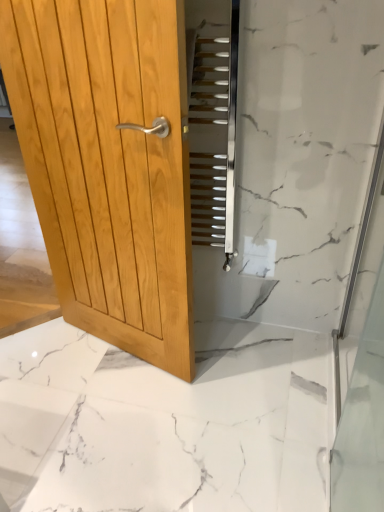
Question: Is light brown wood door at left outside white marble floor at center?

Choices:
 (A) no
 (B) yes

Answer: (B)

Question: From the image's perspective, is light brown wood door at left above white marble floor at center?

Choices:
 (A) yes
 (B) no

Answer: (A)

Question: Is light brown wood door at left bigger than white marble floor at center?

Choices:
 (A) yes
 (B) no

Answer: (B)

Question: Does light brown wood door at left turn towards white marble floor at center?

Choices:
 (A) yes
 (B) no

Answer: (A)

Question: Can you confirm if light brown wood door at left is wider than white marble floor at center?

Choices:
 (A) no
 (B) yes

Answer: (A)

Question: Is light brown wood door at left behind white marble floor at center?

Choices:
 (A) yes
 (B) no

Answer: (B)

Question: Is light brown wood door at left taller than metallic silver stairs at center?

Choices:
 (A) yes
 (B) no

Answer: (A)

Question: Is light brown wood door at left thinner than metallic silver stairs at center?

Choices:
 (A) yes
 (B) no

Answer: (B)

Question: Can you confirm if light brown wood door at left is positioned to the left of metallic silver stairs at center?

Choices:
 (A) yes
 (B) no

Answer: (A)

Question: Can you confirm if light brown wood door at left is positioned to the right of metallic silver stairs at center?

Choices:
 (A) yes
 (B) no

Answer: (B)

Question: From a real-world perspective, is light brown wood door at left beneath metallic silver stairs at center?

Choices:
 (A) no
 (B) yes

Answer: (B)

Question: Is light brown wood door at left positioned far away from metallic silver stairs at center?

Choices:
 (A) yes
 (B) no

Answer: (B)

Question: From a real-world perspective, is transparent glass shower door at right on white marble floor at center?

Choices:
 (A) yes
 (B) no

Answer: (A)